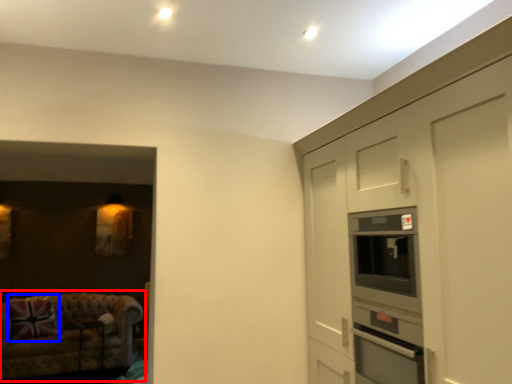
Question: Which object appears farthest to the camera in this image, studio couch (highlighted by a red box) or pillow (highlighted by a blue box)?

Choices:
 (A) studio couch
 (B) pillow

Answer: (B)